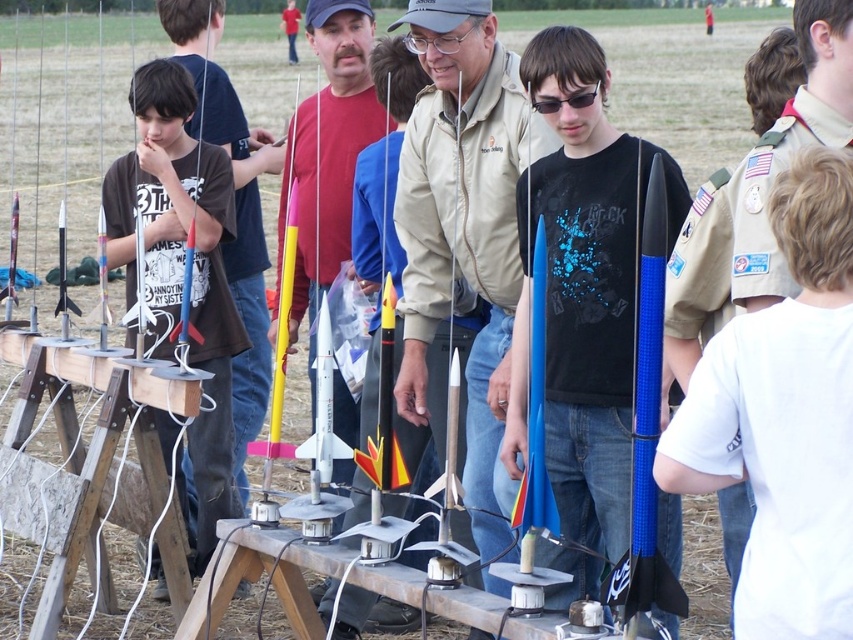
You are a participant in a rocket launch event. You need to put on your safety gear before the launch. Your matte khaki jacket at center and your black plastic goggles at center are both on the ground. If you can reach 36 inches in one direction, can you grab both items without moving your position?

The matte khaki jacket at center and black plastic goggles at center are 37.12 inches apart from each other. Since your reach is 36 inches, you cannot grab both items without moving because the distance between them exceeds your reach.

You are a participant at a rocket launch event and notice two items at the center of your view. Which item is closer to the ground, the matte khaki jacket at center or the black plastic goggles at center?

The matte khaki jacket at center is closer to the ground because it is positioned below the black plastic goggles at center.